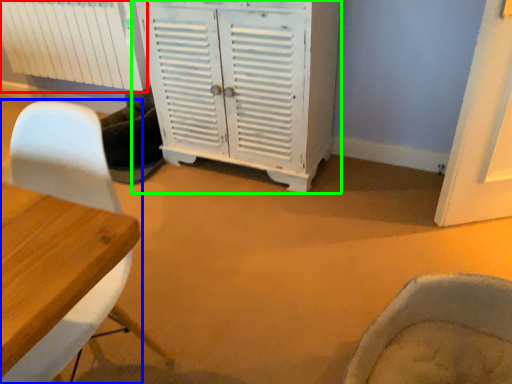
Question: Which object is positioned farthest from radiator (highlighted by a red box)? Select from chair (highlighted by a blue box) and cabinetry (highlighted by a green box).

Choices:
 (A) chair
 (B) cabinetry

Answer: (A)